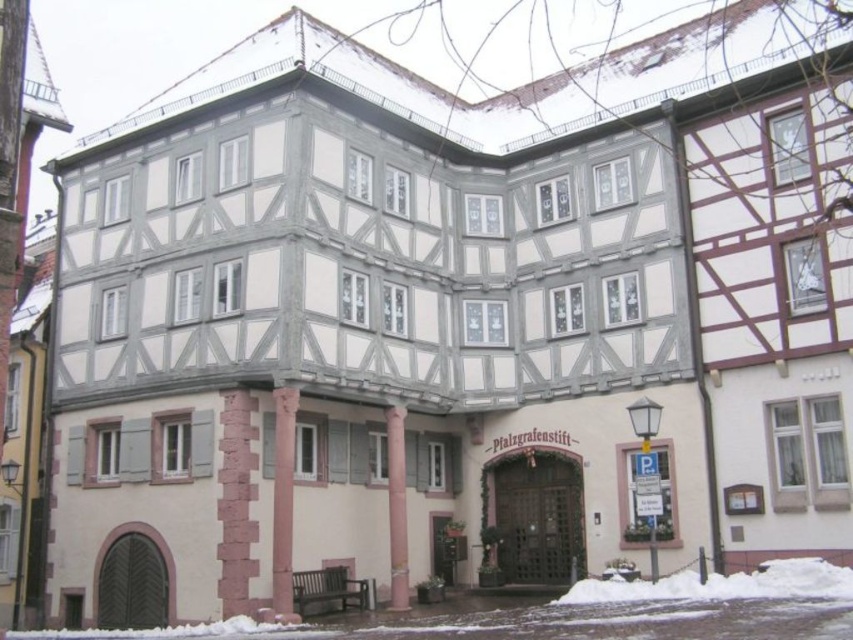
Question: Which point is closer to the camera?

Choices:
 (A) (811, 598)
 (B) (802, 576)
 (C) (230, 589)

Answer: (A)

Question: Is red brick column at center positioned behind pink stone pillar at lower left?

Choices:
 (A) yes
 (B) no

Answer: (A)

Question: Which point is farther to the camera?

Choices:
 (A) (741, 628)
 (B) (819, 576)

Answer: (B)

Question: Can you confirm if white powdery snow at lower left is bigger than red brick column at center?

Choices:
 (A) no
 (B) yes

Answer: (B)

Question: Estimate the real-world distances between objects in this image. Which object is closer to the pink painted wood column at center?

Choices:
 (A) white powdery snow at lower left
 (B) red brick column at center
 (C) white powdery snow at lower center

Answer: (B)

Question: Is red brick column at center above pink stone pillar at lower left?

Choices:
 (A) yes
 (B) no

Answer: (A)